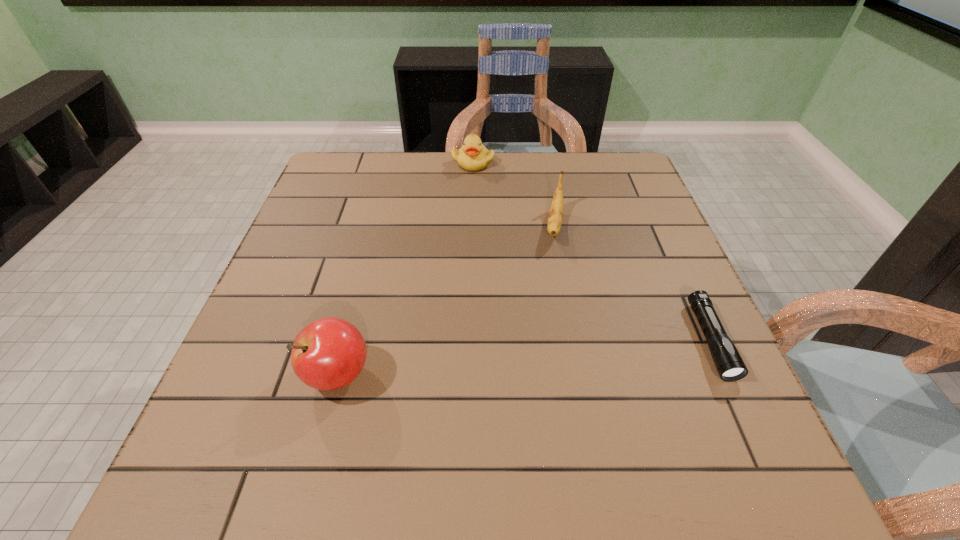
Locate an element on the screen. vacant region located 0.140m on the peel of the banana from the top is located at coordinates (551, 291).

Where is `free space located on the peel of the banana from the top`? This screenshot has width=960, height=540. free space located on the peel of the banana from the top is located at coordinates (553, 275).

The width and height of the screenshot is (960, 540). What are the coordinates of `free space located 0.190m on the peel of the banana from the top` in the screenshot? It's located at (549, 308).

Where is `vacant area situated at the face of the second object from left to right`? This screenshot has width=960, height=540. vacant area situated at the face of the second object from left to right is located at coordinates (497, 218).

I want to click on free space located at the face of the second object from left to right, so click(x=507, y=240).

Image resolution: width=960 pixels, height=540 pixels. Find the location of `free location located 0.340m at the face of the second object from left to right`. free location located 0.340m at the face of the second object from left to right is located at coordinates 510,248.

You are a GUI agent. You are given a task and a screenshot of the screen. Output one action in this format:
    pyautogui.click(x=<x>, y=<y>)
    Task: Click on the object present at the far edge
    
    Given the screenshot: What is the action you would take?
    pyautogui.click(x=473, y=156)

Image resolution: width=960 pixels, height=540 pixels. In order to click on object located in the near edge section of the desktop in this screenshot , I will do `click(329, 353)`.

The height and width of the screenshot is (540, 960). I want to click on object that is at the left edge, so click(329, 353).

The width and height of the screenshot is (960, 540). Identify the location of object present at the right edge. (730, 366).